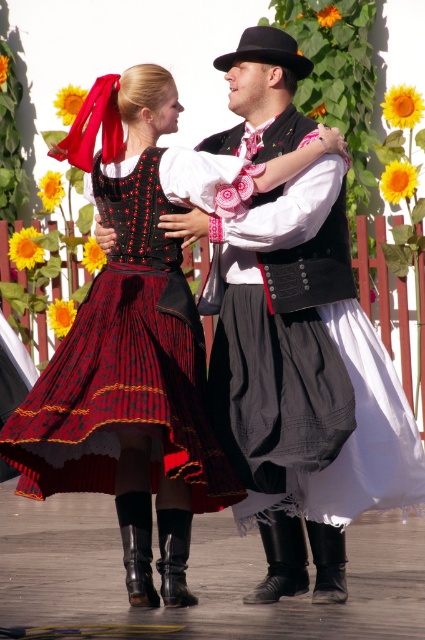
Measure the distance between matte black skirt at center and camera.

matte black skirt at center is 7.11 meters from camera.

Who is more forward, [207,157] or [175,371]?

Positioned in front is point [175,371].

Which is in front, point (195, 163) or point (133, 196)?

Positioned in front is point (195, 163).

The width and height of the screenshot is (425, 640). I want to click on matte black skirt at center, so click(139, 336).

Is point (311, 145) farther from camera compared to point (377, 401)?

No, it is in front of (377, 401).

Who is positioned more to the right, matte black skirt at center or black velvet vest at center?

Positioned to the right is black velvet vest at center.

Image resolution: width=425 pixels, height=640 pixels. Find the location of `matte black skirt at center`. matte black skirt at center is located at coordinates (139, 336).

Can you confirm if black velvet vest at center is smaller than rich burgundy velvet skirt at center?

Yes, black velvet vest at center is smaller than rich burgundy velvet skirt at center.

Between point (204, 148) and point (192, 461), which one is positioned behind?

The point (204, 148) is behind.

This screenshot has height=640, width=425. I want to click on black velvet vest at center, so click(306, 364).